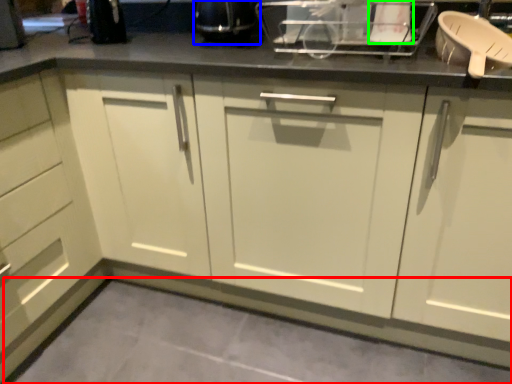
Question: Considering the real-world distances, which object is closest to concrete (highlighted by a red box)? appliance (highlighted by a blue box) or appliance (highlighted by a green box).

Choices:
 (A) appliance
 (B) appliance

Answer: (A)